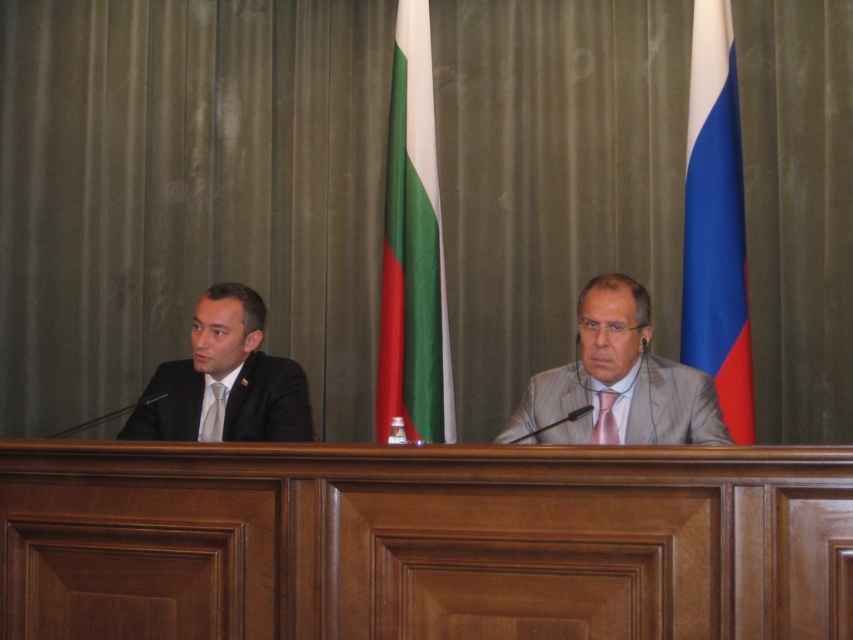
Question: Can you confirm if green fabric flag at center is smaller than matte black tie at left?

Choices:
 (A) no
 (B) yes

Answer: (A)

Question: Among these points, which one is farthest from the camera?

Choices:
 (A) (724, 173)
 (B) (201, 440)
 (C) (206, 412)
 (D) (402, 305)

Answer: (D)

Question: Which object is the farthest from the pink satin tie at center?

Choices:
 (A) green fabric flag at center
 (B) matte black suit at left
 (C) matte black tie at left
 (D) light gray suit at center

Answer: (A)

Question: Which object is positioned closest to the green fabric flag at center?

Choices:
 (A) light gray suit at center
 (B) pink satin tie at center

Answer: (A)

Question: Where is matte black suit at left located in relation to pink satin tie at center in the image?

Choices:
 (A) below
 (B) above

Answer: (B)

Question: Does green fabric flag at center lie in front of blue fabric flag at right?

Choices:
 (A) no
 (B) yes

Answer: (A)